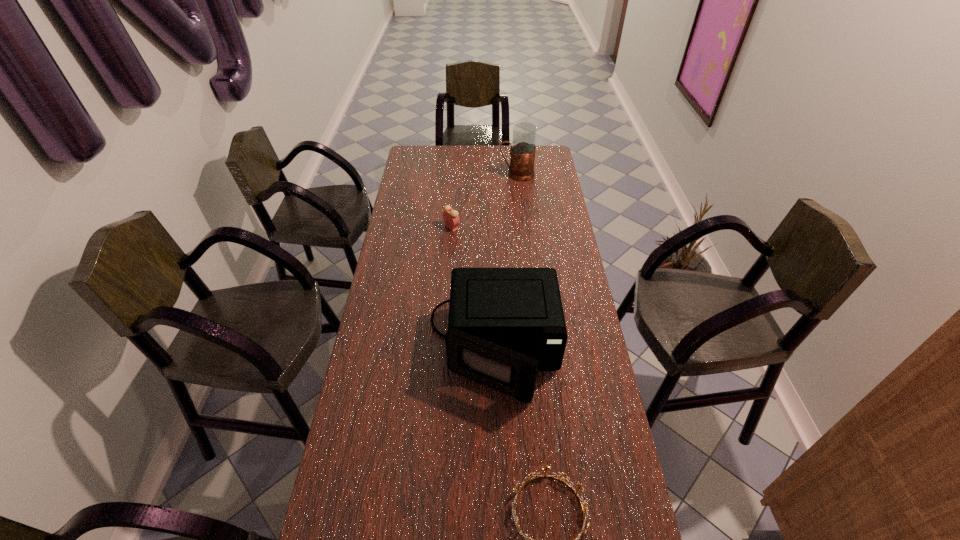
The width and height of the screenshot is (960, 540). I want to click on the farthest object, so click(x=522, y=151).

I want to click on the tallest object, so (x=522, y=151).

Where is `the third shortest object`? the third shortest object is located at coordinates (505, 324).

Identify the location of microwave oven. (505, 324).

I want to click on alarm clock, so click(x=450, y=216).

Locate an element on the screen. This screenshot has height=540, width=960. the third nearest object is located at coordinates (450, 216).

At what (x,y) coordinates should I click in order to perform the action: click on free space located 0.280m with the handle on the side of the pitcher. Please return your answer as a coordinate pair (x, y). This screenshot has width=960, height=540. Looking at the image, I should click on click(443, 174).

The width and height of the screenshot is (960, 540). Find the location of `vacant space located 0.080m with the handle on the side of the pitcher`. vacant space located 0.080m with the handle on the side of the pitcher is located at coordinates (x=483, y=174).

The width and height of the screenshot is (960, 540). Identify the location of vacant area located 0.350m with the handle on the side of the pitcher. (429, 174).

Where is `vacant position located 0.300m with the door open on the second nearest object`? Image resolution: width=960 pixels, height=540 pixels. vacant position located 0.300m with the door open on the second nearest object is located at coordinates (501, 523).